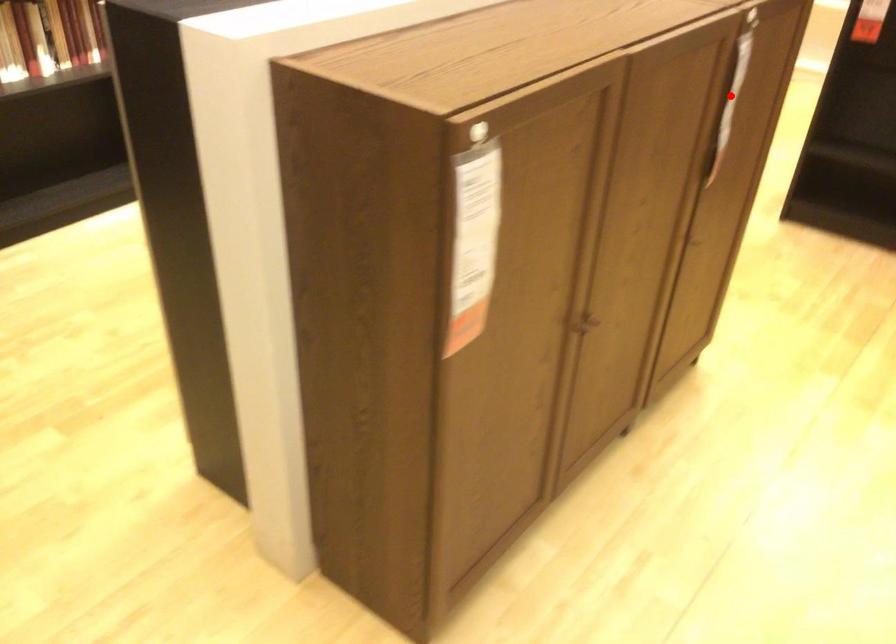
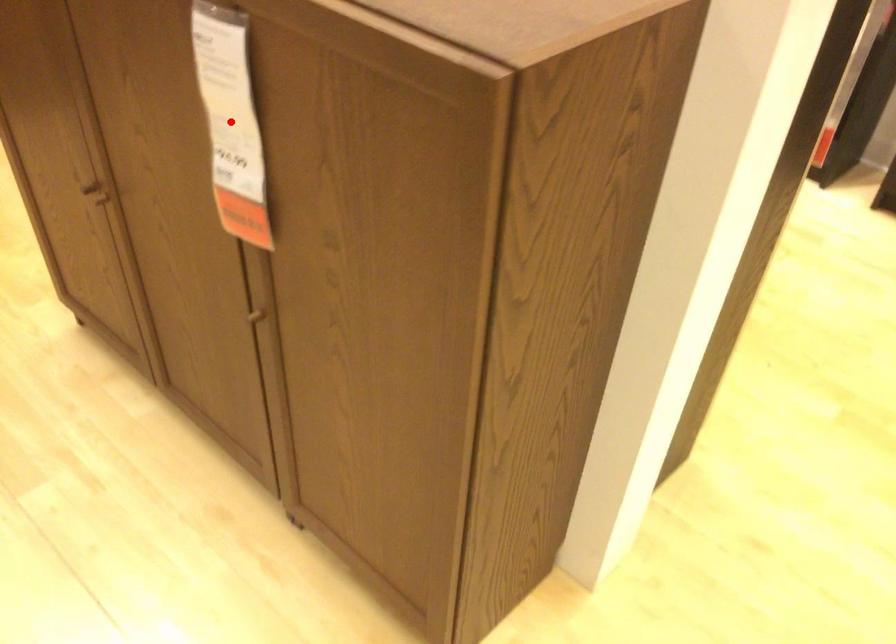
I am providing you with two images of the same scene from different viewpoints. A red point is marked on the first image and another point is marked on the second image. Is the red point in image1 aligned with the point shown in image2?

Yes